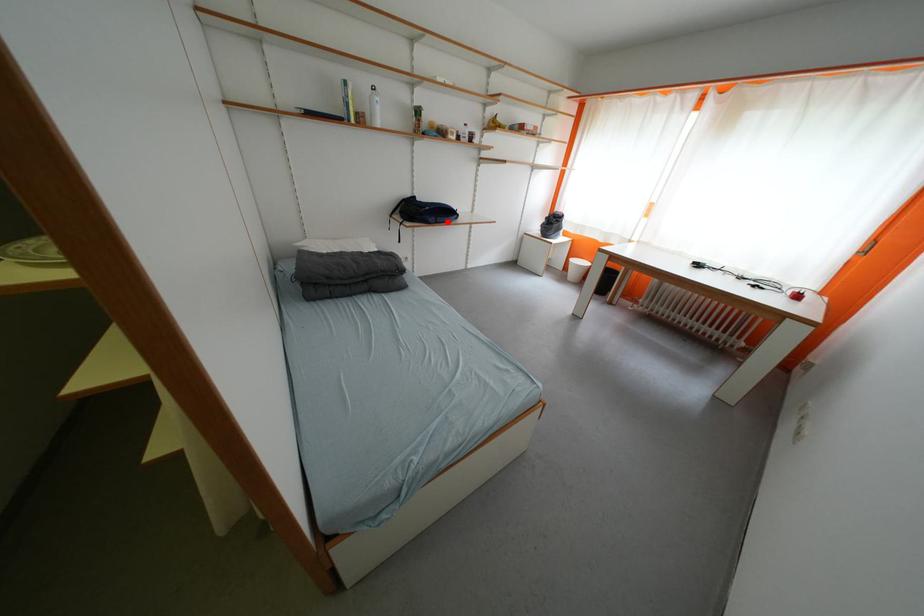
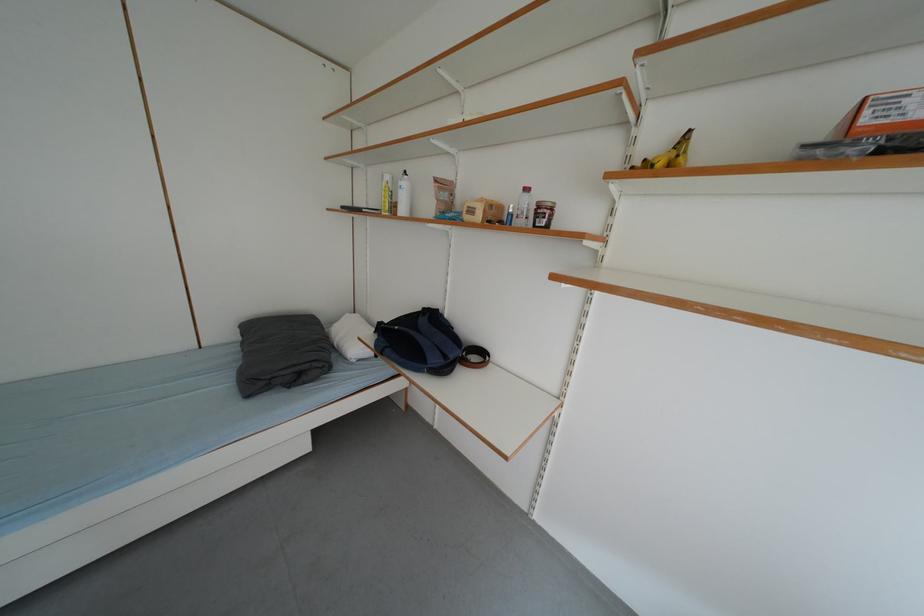
Locate, in the second image, the point that corresponds to the highlighted location in the first image.

(396, 354)